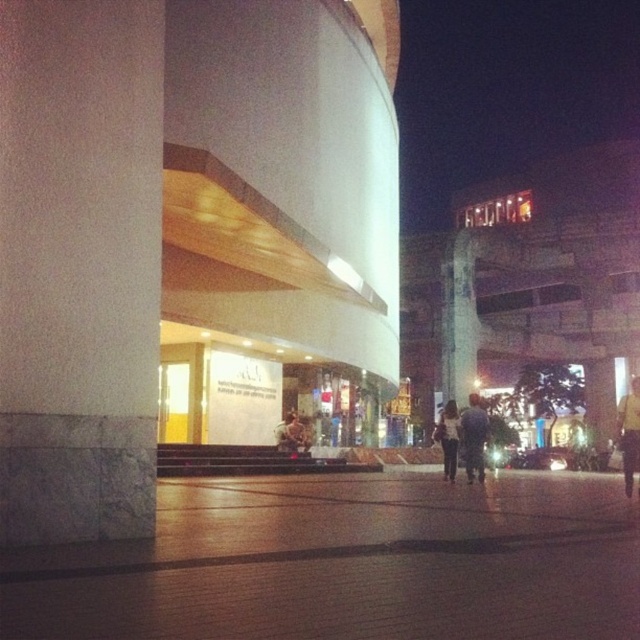
You are a photographer setting up a camera on the ground level. You want to capture both the white marble pillar at left and the white matte shirt at center in your shot. Which object will appear wider in the photograph?

The white matte shirt at center will appear wider in the photograph because its width is greater than the white marble pillar at left.

You are an architect designing a new building and want to ensure that the white marble pillar at left and the white matte shirt at center are proportionally balanced. Given their sizes, which object should you adjust to achieve better proportionality?

The white marble pillar at left has a smaller size compared to the white matte shirt at center, so you should increase the size of the white marble pillar at left to match the scale of the white matte shirt at center for better proportionality.

You are standing at the entrance of the modern architectural structure and want to walk to the brown brick pavement at center. According to the image, in which direction should you move relative to the entrance?

The brown brick pavement at center is located at point (348, 563), which is to the right and slightly forward from the entrance. So you should move towards the right and forward direction relative to the entrance.